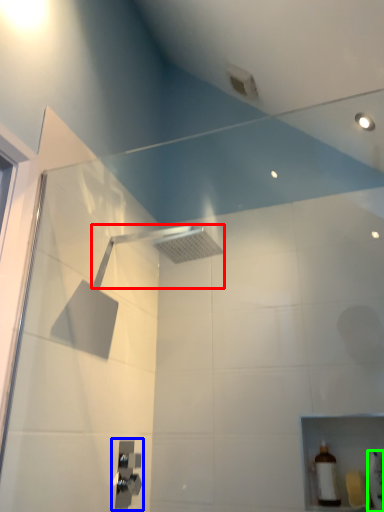
Question: Based on their relative distances, which object is farther from shower (highlighted by a red box)? Choose from shower (highlighted by a blue box) and toiletry (highlighted by a green box).

Choices:
 (A) shower
 (B) toiletry

Answer: (B)